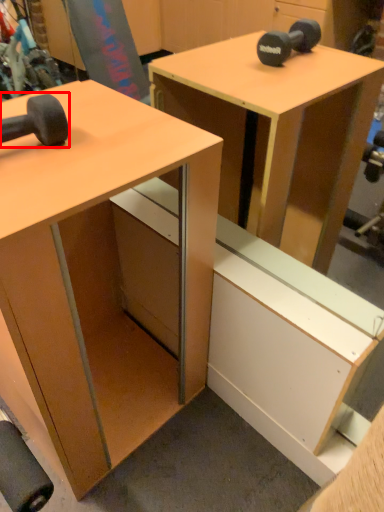
Question: From the image's perspective, what is the correct spatial positioning of dumbbell (annotated by the red box) in reference to desk?

Choices:
 (A) above
 (B) below

Answer: (A)